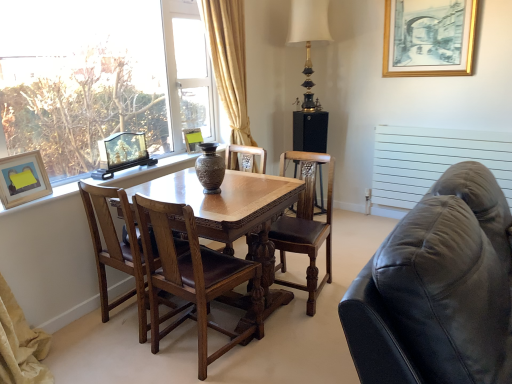
Locate an element on the screen. The width and height of the screenshot is (512, 384). free space underneath gold-framed print at upper right, which is counted as the fourth picture frame, starting from the left (from a real-world perspective) is located at coordinates (416, 119).